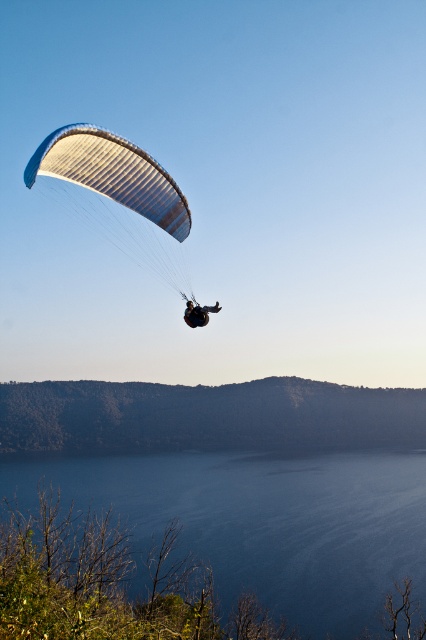
Question: Based on their relative distances, which object is farther from the blue smooth water at center?

Choices:
 (A) black fabric parachute at upper left
 (B) matte blue parachute at upper left
 (C) brown textured hillside at lower center

Answer: (A)

Question: Which is farther from the matte blue parachute at upper left?

Choices:
 (A) brown textured hillside at lower center
 (B) blue smooth water at center
 (C) black fabric parachute at upper left

Answer: (A)

Question: Is brown textured hillside at lower center to the right of matte blue parachute at upper left from the viewer's perspective?

Choices:
 (A) no
 (B) yes

Answer: (B)

Question: Observing the image, what is the correct spatial positioning of blue smooth water at center in reference to brown textured hillside at lower center?

Choices:
 (A) below
 (B) above

Answer: (A)

Question: Is brown textured hillside at lower center to the right of black fabric parachute at upper left from the viewer's perspective?

Choices:
 (A) no
 (B) yes

Answer: (B)

Question: Which point is farther from the camera taking this photo?

Choices:
 (A) (137, 202)
 (B) (310, 605)
 (C) (209, 449)

Answer: (C)